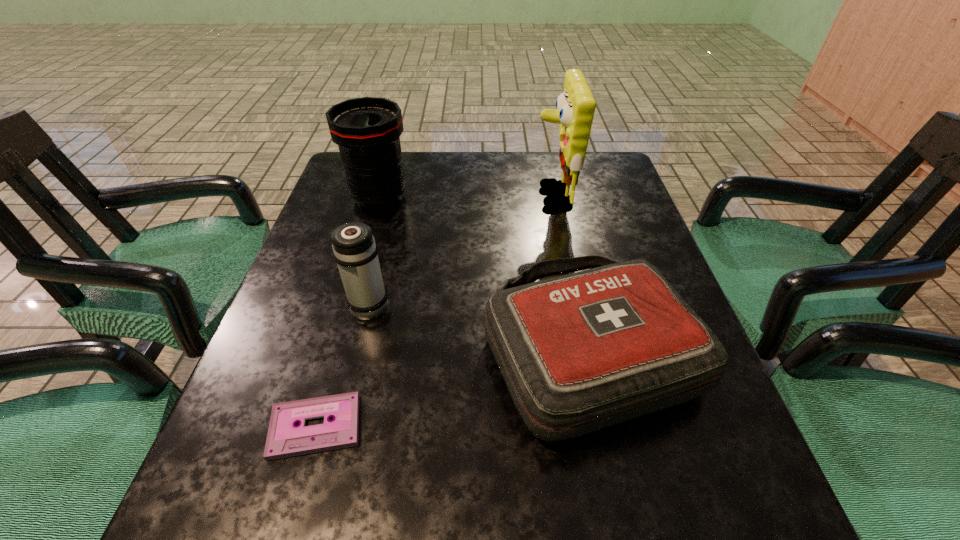
You are a GUI agent. You are given a task and a screenshot of the screen. Output one action in this format:
    pyautogui.click(x=<x>, y=<y>)
    Task: Click on the vacant space located 0.230m on the side with the handle of the third shortest object
    Image resolution: width=960 pixels, height=540 pixels.
    Given the screenshot: What is the action you would take?
    pyautogui.click(x=390, y=220)

This screenshot has height=540, width=960. In order to click on vacant space located on the side with the handle of the third shortest object in this screenshot , I will do `click(398, 185)`.

In order to click on free space located 0.120m on the back of the fourth tallest object in this screenshot , I will do click(565, 241).

Identify the location of vacant space situated on the right of the shortest object. (514, 427).

At what (x,y) coordinates should I click in order to perform the action: click on sponge at the far edge. Please return your answer as a coordinate pair (x, y). Looking at the image, I should click on (575, 106).

Locate an element on the screen. Image resolution: width=960 pixels, height=540 pixels. telephoto lens positioned at the far edge is located at coordinates (367, 130).

Locate an element on the screen. telephoto lens present at the left edge is located at coordinates (367, 130).

This screenshot has width=960, height=540. Identify the location of thermos bottle that is at the left edge. (354, 249).

Locate an element on the screen. videotape at the left edge is located at coordinates (285, 439).

Locate an element on the screen. sponge at the right edge is located at coordinates (575, 106).